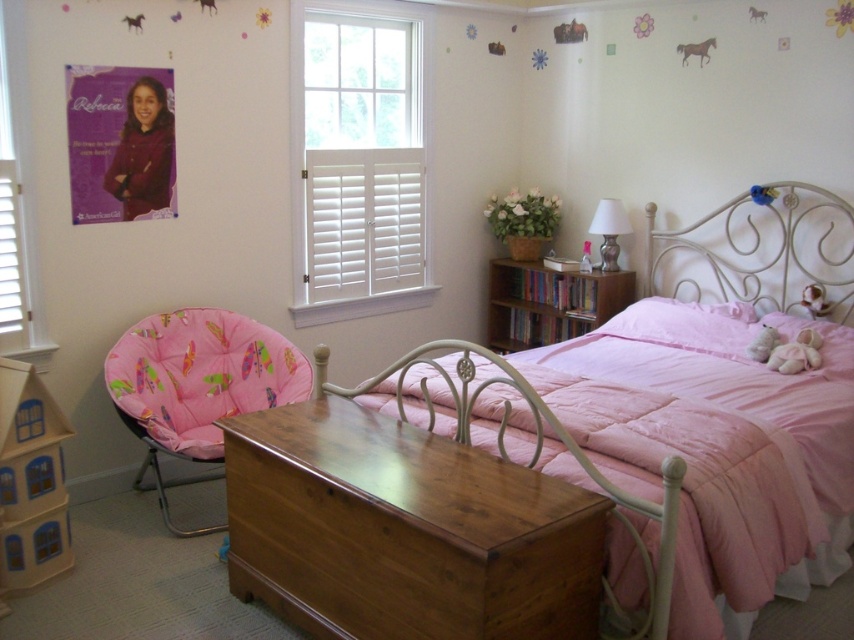
Based on the photo, which of these two, pink plush pillow at center or matte pink teddy bear at center, stands shorter?

matte pink teddy bear at center is shorter.

Which is in front, point (775, 317) or point (589, 262)?

Point (775, 317)

At what (x,y) coordinates should I click in order to perform the action: click on pink plush pillow at center. Please return your answer as a coordinate pair (x, y). Image resolution: width=854 pixels, height=640 pixels. Looking at the image, I should click on (822, 337).

Between point (665, 304) and point (806, 285), which one is positioned in front?

Positioned in front is point (806, 285).

Is point (752, 321) more distant than point (802, 300)?

That is True.

Which is behind, point (683, 346) or point (816, 285)?

Point (683, 346)

At what (x,y) coordinates should I click in order to perform the action: click on pink satin pillow at center. Please return your answer as a coordinate pair (x, y). Image resolution: width=854 pixels, height=640 pixels. Looking at the image, I should click on (687, 324).

Who is lower down, wooden dollhouse at lower left or white glossy lamp at upper right?

wooden dollhouse at lower left

Which of these two, wooden dollhouse at lower left or white glossy lamp at upper right, stands taller?

Standing taller between the two is wooden dollhouse at lower left.

I want to click on wooden dollhouse at lower left, so click(x=30, y=481).